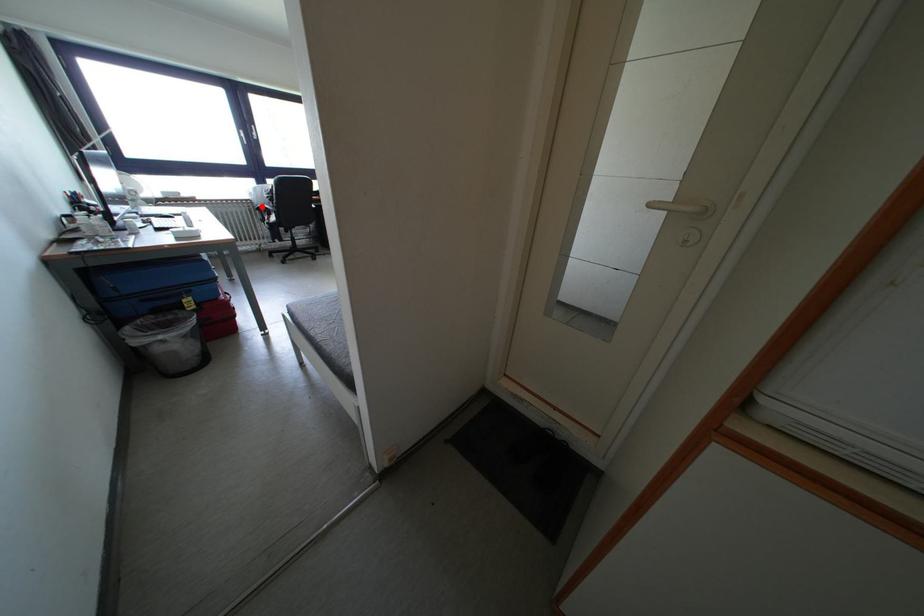
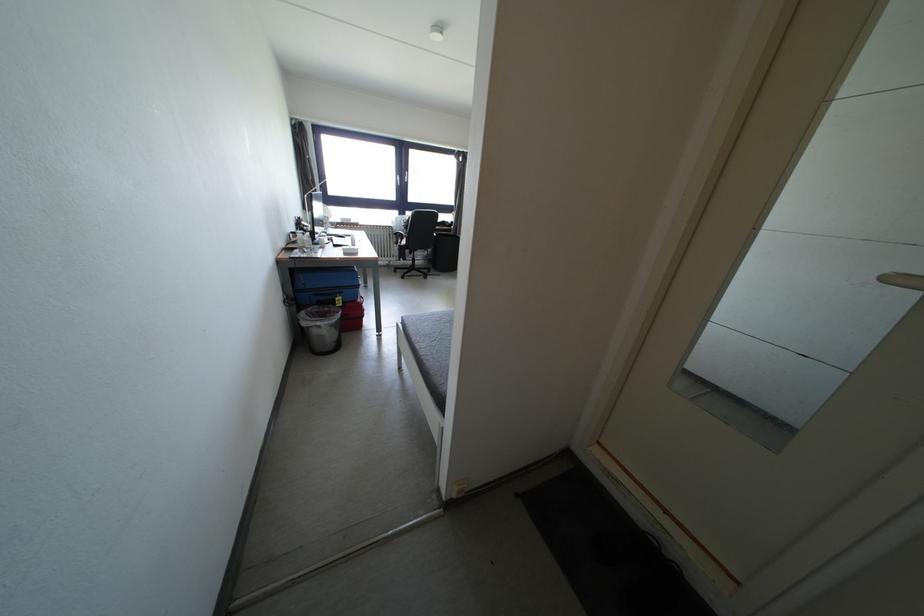
In the second image, find the point that corresponds to the highlighted location in the first image.

(400, 233)